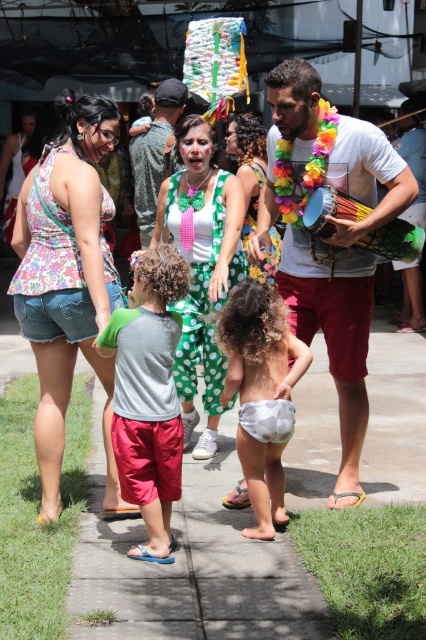
Is green polka dot pants at center above white textured diaper at center?

Yes, green polka dot pants at center is above white textured diaper at center.

Is point (164, 182) behind point (265, 424)?

Yes, point (164, 182) is behind point (265, 424).

Where is `green polka dot pants at center`? Image resolution: width=426 pixels, height=640 pixels. green polka dot pants at center is located at coordinates (201, 266).

Which is behind, point (330, 337) or point (127, 323)?

The point (330, 337) is more distant.

At what (x,y) coordinates should I click in order to perform the action: click on white cotton t-shirt at center. Please return your answer as a coordinate pair (x, y). The width and height of the screenshot is (426, 640). Looking at the image, I should click on (345, 280).

Does point (278, 80) come behind point (178, 269)?

Yes, point (278, 80) is behind point (178, 269).

Find the location of a particular element. The height and width of the screenshot is (640, 426). white cotton t-shirt at center is located at coordinates (345, 280).

Does point (121, 440) come in front of point (239, 412)?

That is True.

Who is more forward, (172, 324) or (261, 349)?

Positioned in front is point (172, 324).

The width and height of the screenshot is (426, 640). In order to click on gray cotton shirt at center in this screenshot , I will do (x=149, y=396).